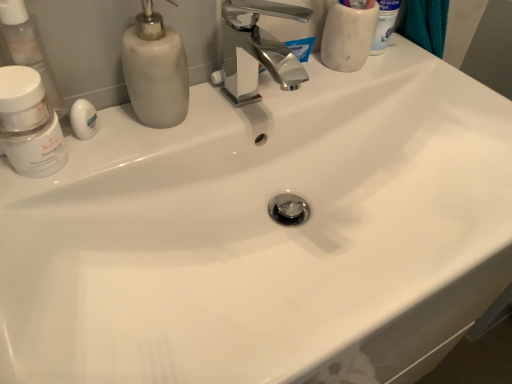
Where is `free space in front of matte white soap dispenser at upper left`? Image resolution: width=512 pixels, height=384 pixels. free space in front of matte white soap dispenser at upper left is located at coordinates (102, 193).